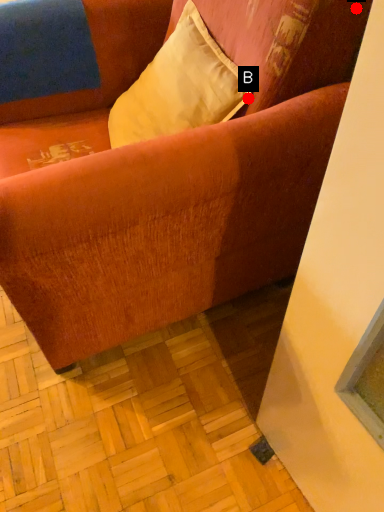
Question: Two points are circled on the image, labeled by A and B beside each circle. Which point appears closest to the camera in this image?

Choices:
 (A) A is closer
 (B) B is closer

Answer: (A)